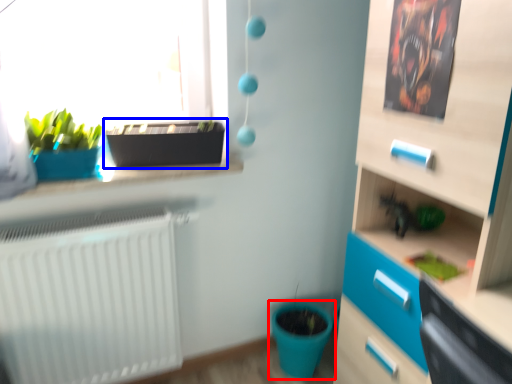
Question: Which object is closer to the camera taking this photo, flowerpot (highlighted by a red box) or flowerpot (highlighted by a blue box)?

Choices:
 (A) flowerpot
 (B) flowerpot

Answer: (B)